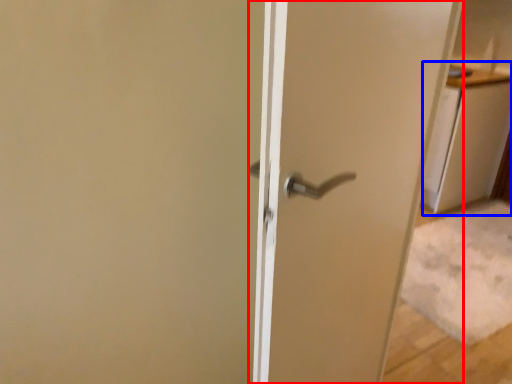
Question: Which of the following is the farthest to the observer, door (highlighted by a red box) or cabinetry (highlighted by a blue box)?

Choices:
 (A) door
 (B) cabinetry

Answer: (B)